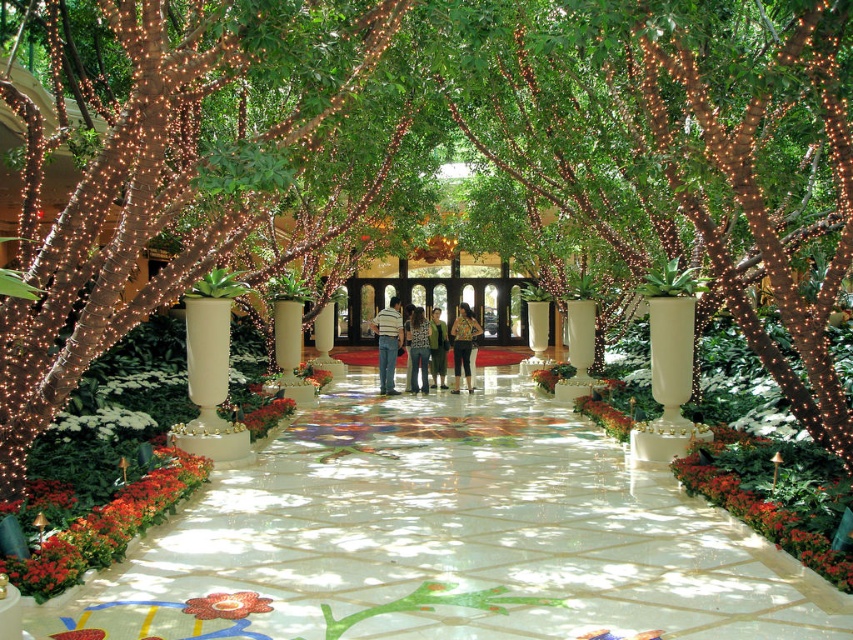
Question: Estimate the real-world distances between objects in this image. Which object is farther from the green leafy plant at lower right?

Choices:
 (A) shiny brown bark at center
 (B) red glossy flower at lower left
 (C) red velvet flower at center

Answer: (A)

Question: Estimate the real-world distances between objects in this image. Which object is farther from the red velvet flower at center?

Choices:
 (A) green textured sweater at center
 (B) striped cotton shirt at center
 (C) denim jeans at center
 (D) shiny brown bark at center

Answer: (A)

Question: Which point is farther to the camera?

Choices:
 (A) (148, 474)
 (B) (674, 472)

Answer: (B)

Question: Does green leafy plant at lower right lie behind green matte flower at center?

Choices:
 (A) no
 (B) yes

Answer: (A)

Question: Can you confirm if light brown leather jacket at center is positioned below red velvet flower at center?

Choices:
 (A) no
 (B) yes

Answer: (A)

Question: Does striped cotton shirt at center appear under green matte flower at center?

Choices:
 (A) no
 (B) yes

Answer: (A)